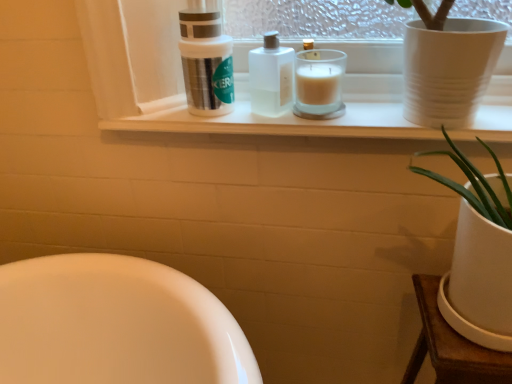
In order to click on vacant space to the right of clear plastic bottle at center in this screenshot , I will do `click(366, 119)`.